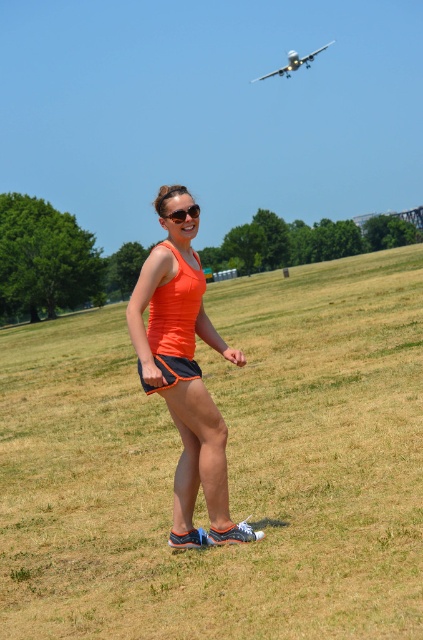
Question: Is green grass at center positioned in front of orange mesh shorts at center?

Choices:
 (A) yes
 (B) no

Answer: (A)

Question: Is green grass at center above matte black sunglasses at center?

Choices:
 (A) yes
 (B) no

Answer: (B)

Question: Which point appears farthest from the camera in this image?

Choices:
 (A) (153, 390)
 (B) (197, 205)
 (C) (206, 496)
 (D) (79, 632)

Answer: (C)

Question: Is orange mesh shorts at center below matte black sunglasses at center?

Choices:
 (A) no
 (B) yes

Answer: (B)

Question: Which object is farther from the camera taking this photo?

Choices:
 (A) matte black sunglasses at center
 (B) green grass at center

Answer: (A)

Question: Which object is positioned closest to the orange mesh shorts at center?

Choices:
 (A) white matte airplane at upper center
 (B) orange fabric tank top at center
 (C) matte black sunglasses at center
 (D) green grass at center

Answer: (B)